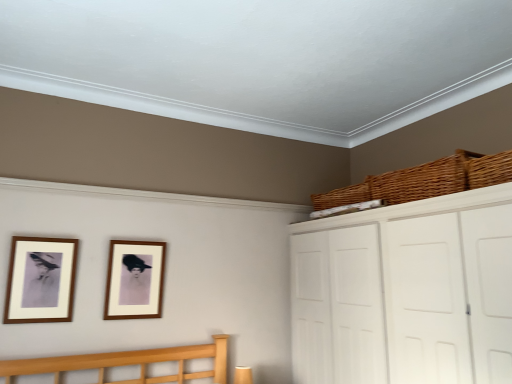
Find the location of a particular element. The height and width of the screenshot is (384, 512). woven brown basket at upper right, arranged as the second basket when viewed from the front is located at coordinates (424, 180).

The width and height of the screenshot is (512, 384). What are the coordinates of `white matte cabinet at upper right` in the screenshot? It's located at (406, 293).

I want to click on wooden picture frame at center, the first picture frame positioned from the back, so click(x=134, y=280).

Locate an element on the screen. matte wood picture frame at left, arranged as the 1th picture frame when viewed from the left is located at coordinates (41, 280).

This screenshot has height=384, width=512. What do you see at coordinates (41, 280) in the screenshot? I see `matte wood picture frame at left, positioned as the second picture frame in right-to-left order` at bounding box center [41, 280].

Locate an element on the screen. The height and width of the screenshot is (384, 512). woven brown basket at upper right, arranged as the second basket when viewed from the front is located at coordinates (424, 180).

Is woven brown basket at upper right, placed as the second basket when sorted from back to front, situated inside woven brown basket at upper right, placed as the 1th basket when sorted from front to back, or outside?

woven brown basket at upper right, placed as the second basket when sorted from back to front, is located beyond the bounds of woven brown basket at upper right, placed as the 1th basket when sorted from front to back.

Between woven brown basket at upper right, placed as the second basket when sorted from back to front, and woven brown basket at upper right, acting as the third basket starting from the back, which one appears on the right side from the viewer's perspective?

woven brown basket at upper right, acting as the third basket starting from the back.

From a real-world perspective, which is physically below, woven brown basket at upper right, arranged as the second basket when viewed from the front, or woven brown basket at upper right, placed as the 1th basket when sorted from front to back?

woven brown basket at upper right, placed as the 1th basket when sorted from front to back, is physically lower.

From the image's perspective, would you say woven brown basket at upper right, placed as the second basket when sorted from back to front, is shown under woven brown basket at upper right, placed as the 1th basket when sorted from front to back?

Yes.

From a real-world perspective, is wooden picture frame at center, the second picture frame positioned from the front, beneath woven brown basket at upper right, marked as the 1th basket in a back-to-front arrangement?

Indeed, from a real-world perspective, wooden picture frame at center, the second picture frame positioned from the front, is positioned beneath woven brown basket at upper right, marked as the 1th basket in a back-to-front arrangement.

You are a GUI agent. You are given a task and a screenshot of the screen. Output one action in this format:
    pyautogui.click(x=<x>, y=<y>)
    Task: Click on the 2nd picture frame below the woven brown basket at upper right, marked as the 1th basket in a back-to-front arrangement (from the image's perspective)
    
    Given the screenshot: What is the action you would take?
    [134, 280]

From their relative heights in the image, would you say wooden picture frame at center, the first picture frame positioned from the back, is taller or shorter than woven brown basket at upper right, marked as the 1th basket in a back-to-front arrangement?

Clearly, wooden picture frame at center, the first picture frame positioned from the back, is taller compared to woven brown basket at upper right, marked as the 1th basket in a back-to-front arrangement.

Is woven brown basket at upper right, which appears as the 3th basket when viewed from the front, at the back of wooden picture frame at center, the second picture frame positioned from the front?

wooden picture frame at center, the second picture frame positioned from the front, does not have its back to woven brown basket at upper right, which appears as the 3th basket when viewed from the front.

Considering the sizes of wooden picture frame at center, the first picture frame positioned from the back, and woven brown basket at upper right, placed as the second basket when sorted from back to front, in the image, is wooden picture frame at center, the first picture frame positioned from the back, taller or shorter than woven brown basket at upper right, placed as the second basket when sorted from back to front,?

In the image, wooden picture frame at center, the first picture frame positioned from the back, appears to be taller than woven brown basket at upper right, placed as the second basket when sorted from back to front.

Which is nearer, (119, 302) or (361, 194)?

Point (119, 302) is closer to the camera than point (361, 194).

Is wooden picture frame at center, the first picture frame positioned from the back, not within woven brown basket at upper right, arranged as the second basket when viewed from the front?

wooden picture frame at center, the first picture frame positioned from the back, is positioned outside woven brown basket at upper right, arranged as the second basket when viewed from the front.

How far apart are wooden picture frame at center, the second picture frame positioned from the front, and woven brown basket at upper right, arranged as the second basket when viewed from the front?

wooden picture frame at center, the second picture frame positioned from the front, and woven brown basket at upper right, arranged as the second basket when viewed from the front, are 4.60 feet apart.

Choose the correct answer: Is woven brown basket at upper right, placed as the second basket when sorted from back to front, inside white matte cabinet at upper right or outside it?

woven brown basket at upper right, placed as the second basket when sorted from back to front, exists outside the volume of white matte cabinet at upper right.

Considering the sizes of objects woven brown basket at upper right, arranged as the second basket when viewed from the front, and white matte cabinet at upper right in the image provided, who is wider, woven brown basket at upper right, arranged as the second basket when viewed from the front, or white matte cabinet at upper right?

With larger width is white matte cabinet at upper right.

Is woven brown basket at upper right, arranged as the second basket when viewed from the front, looking in the opposite direction of white matte cabinet at upper right?

No, woven brown basket at upper right, arranged as the second basket when viewed from the front, is not facing the opposite direction of white matte cabinet at upper right.

From a real-world perspective, is matte wood picture frame at left, the first picture frame positioned from the front, physically above wooden picture frame at center, the first picture frame positioned from the back?

Indeed, from a real-world perspective, matte wood picture frame at left, the first picture frame positioned from the front, stands above wooden picture frame at center, the first picture frame positioned from the back.

In the scene shown: Is matte wood picture frame at left, the 2th picture frame from the back, smaller than wooden picture frame at center, the first picture frame positioned from the back?

Yes, matte wood picture frame at left, the 2th picture frame from the back, is smaller than wooden picture frame at center, the first picture frame positioned from the back.

Is matte wood picture frame at left, positioned as the second picture frame in right-to-left order, spatially inside wooden picture frame at center, the first picture frame positioned from the back, or outside of it?

matte wood picture frame at left, positioned as the second picture frame in right-to-left order, is not enclosed by wooden picture frame at center, the first picture frame positioned from the back.

Looking at their sizes, would you say matte wood picture frame at left, the first picture frame positioned from the front, is wider or thinner than wooden picture frame at center, the first picture frame positioned from the back?

Considering their sizes, matte wood picture frame at left, the first picture frame positioned from the front, looks slimmer than wooden picture frame at center, the first picture frame positioned from the back.

Which of these two, woven brown basket at upper right, which appears as the 3th basket when viewed from the front, or matte wood picture frame at left, the 2th picture frame from the back, is smaller?

matte wood picture frame at left, the 2th picture frame from the back, is smaller.

Between point (345, 200) and point (59, 248), which one is positioned behind?

The point (345, 200) is farther.

Is woven brown basket at upper right, marked as the 1th basket in a back-to-front arrangement, located outside matte wood picture frame at left, arranged as the 1th picture frame when viewed from the left?

Absolutely, woven brown basket at upper right, marked as the 1th basket in a back-to-front arrangement, is external to matte wood picture frame at left, arranged as the 1th picture frame when viewed from the left.

Considering the sizes of objects woven brown basket at upper right, marked as the 1th basket in a back-to-front arrangement, and matte wood picture frame at left, arranged as the 1th picture frame when viewed from the left, in the image provided, who is taller, woven brown basket at upper right, marked as the 1th basket in a back-to-front arrangement, or matte wood picture frame at left, arranged as the 1th picture frame when viewed from the left,?

Standing taller between the two is matte wood picture frame at left, arranged as the 1th picture frame when viewed from the left.

Considering the relative positions of white matte cabinet at upper right and woven brown basket at upper right, placed as the second basket when sorted from back to front, in the image provided, is white matte cabinet at upper right behind woven brown basket at upper right, placed as the second basket when sorted from back to front,?

No, the depth of white matte cabinet at upper right is less than that of woven brown basket at upper right, placed as the second basket when sorted from back to front.

Would you consider white matte cabinet at upper right to be distant from woven brown basket at upper right, arranged as the second basket when viewed from the front?

white matte cabinet at upper right is near woven brown basket at upper right, arranged as the second basket when viewed from the front, not far away.

Is white matte cabinet at upper right surrounding woven brown basket at upper right, arranged as the second basket when viewed from the front?

No, woven brown basket at upper right, arranged as the second basket when viewed from the front, is located outside of white matte cabinet at upper right.

This screenshot has height=384, width=512. What are the coordinates of `basket above the woven brown basket at upper right, arranged as the second basket when viewed from the front (from the image's perspective)` in the screenshot? It's located at (489, 170).

This screenshot has width=512, height=384. I want to click on basket behind the wooden picture frame at center, the second picture frame positioned from the front, so click(x=342, y=197).

From the image, which object appears to be nearer to woven brown basket at upper right, arranged as the second basket when viewed from the front, wooden picture frame at center, marked as the second picture frame in a left-to-right arrangement, or woven brown basket at upper right, marked as the 1th basket in a back-to-front arrangement?

Based on the image, woven brown basket at upper right, marked as the 1th basket in a back-to-front arrangement, appears to be nearer to woven brown basket at upper right, arranged as the second basket when viewed from the front.

From the image, which object appears to be nearer to white matte cabinet at upper right, woven brown basket at upper right, placed as the second basket when sorted from back to front, or woven brown basket at upper right, acting as the third basket starting from the back?

woven brown basket at upper right, placed as the second basket when sorted from back to front, is positioned closer to the anchor white matte cabinet at upper right.

Based on their spatial positions, is wooden picture frame at center, positioned as the 1th picture frame in right-to-left order, or matte wood picture frame at left, arranged as the 1th picture frame when viewed from the left, closer to woven brown basket at upper right, placed as the second basket when sorted from back to front?

wooden picture frame at center, positioned as the 1th picture frame in right-to-left order, is closer to woven brown basket at upper right, placed as the second basket when sorted from back to front.

Which object lies further to the anchor point white matte cabinet at upper right, woven brown basket at upper right, which appears as the 3th basket when viewed from the front, or woven brown basket at upper right, placed as the second basket when sorted from back to front?

woven brown basket at upper right, which appears as the 3th basket when viewed from the front, lies further to white matte cabinet at upper right than the other object.

Looking at the image, which one is located further to woven brown basket at upper right, acting as the third basket starting from the back, matte wood picture frame at left, arranged as the 1th picture frame when viewed from the left, or wooden picture frame at center, the first picture frame positioned from the back?

matte wood picture frame at left, arranged as the 1th picture frame when viewed from the left.

Which object lies nearer to the anchor point woven brown basket at upper right, which appears as the 3th basket when viewed from the front, woven brown basket at upper right, placed as the second basket when sorted from back to front, or white matte cabinet at upper right?

woven brown basket at upper right, placed as the second basket when sorted from back to front.

Estimate the real-world distances between objects in this image. Which object is further from woven brown basket at upper right, placed as the 1th basket when sorted from front to back, woven brown basket at upper right, arranged as the second basket when viewed from the front, or white matte cabinet at upper right?

white matte cabinet at upper right.

Based on their spatial positions, is woven brown basket at upper right, arranged as the second basket when viewed from the front, or woven brown basket at upper right, marked as the 1th basket in a back-to-front arrangement, closer to matte wood picture frame at left, the first picture frame positioned from the front?

Based on the image, woven brown basket at upper right, marked as the 1th basket in a back-to-front arrangement, appears to be nearer to matte wood picture frame at left, the first picture frame positioned from the front.

Identify the location of basket between woven brown basket at upper right, acting as the third basket starting from the back, and woven brown basket at upper right, which appears as the 3th basket when viewed from the front, in the front-back direction. The height and width of the screenshot is (384, 512). (424, 180).

Where is `picture frame located between matte wood picture frame at left, the 2th picture frame from the back, and white matte cabinet at upper right in the left-right direction`? The height and width of the screenshot is (384, 512). picture frame located between matte wood picture frame at left, the 2th picture frame from the back, and white matte cabinet at upper right in the left-right direction is located at coordinates (134, 280).

Identify the location of dresser between matte wood picture frame at left, positioned as the second picture frame in right-to-left order, and woven brown basket at upper right, arranged as the second basket when viewed from the front. The width and height of the screenshot is (512, 384). (406, 293).

The height and width of the screenshot is (384, 512). I want to click on dresser between matte wood picture frame at left, arranged as the 1th picture frame when viewed from the left, and woven brown basket at upper right, placed as the 1th basket when sorted from front to back, in the horizontal direction, so click(x=406, y=293).